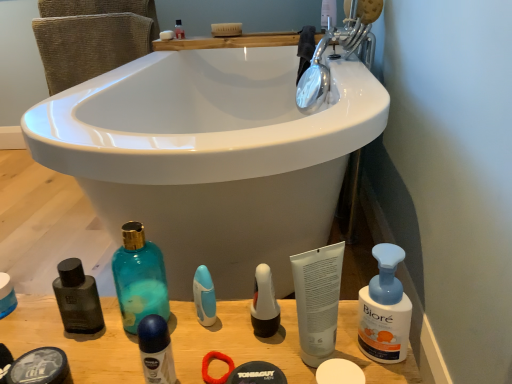
I want to click on free space between blue plastic toothbrush at center, positioned as the second toiletry in back-to-front order, and white matte tube at center, positioned as the first toiletry in front-to-back order, so click(252, 335).